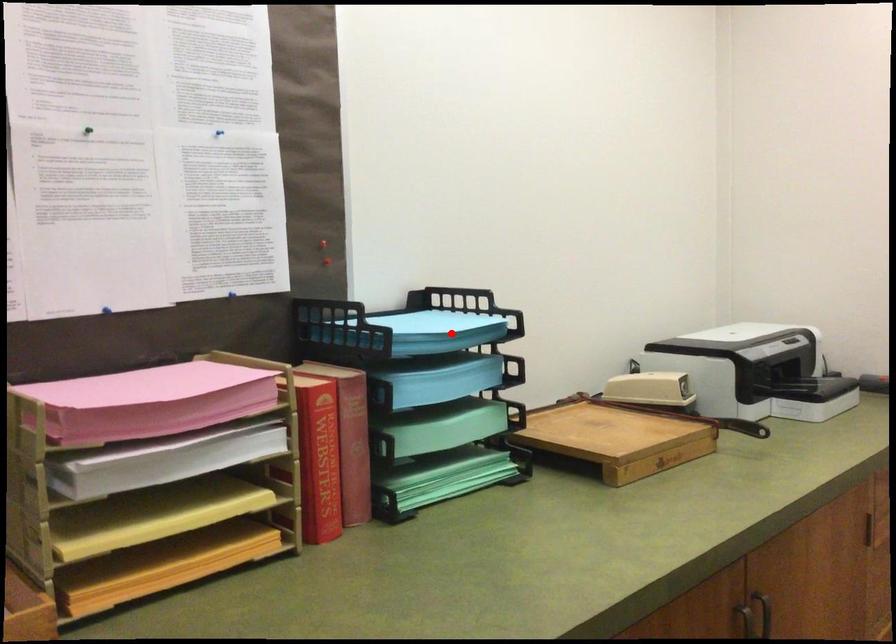
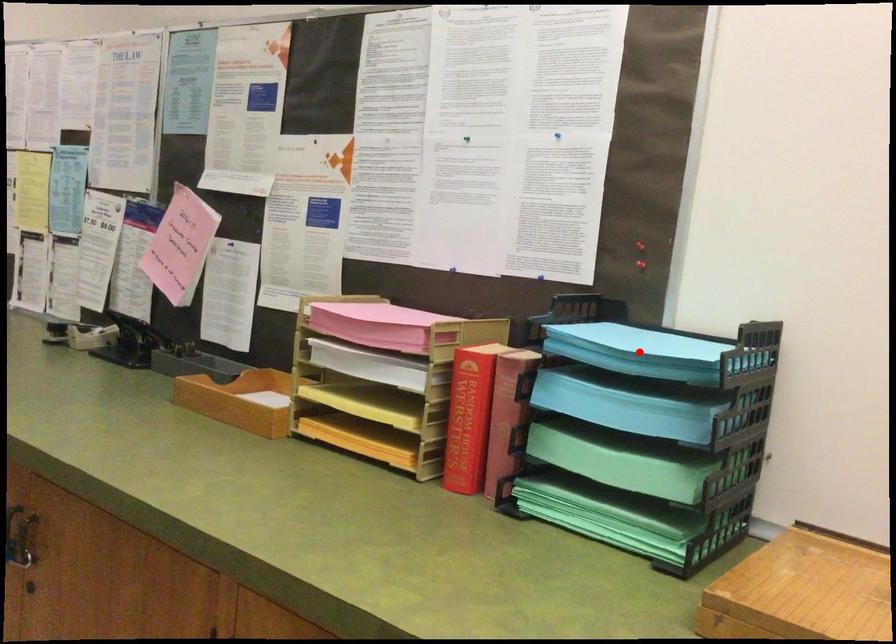
I am providing you with two images of the same scene from different viewpoints. A red point is marked on the first image and another point is marked on the second image. Is the red point in image1 aligned with the point shown in image2?

Yes